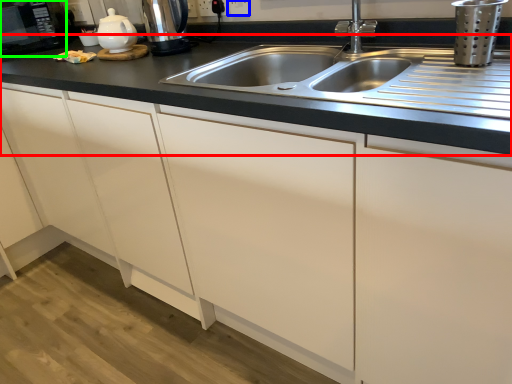
Question: Considering the real-world distances, which object is closest to countertop (highlighted by a red box)? electric outlet (highlighted by a blue box) or appliance (highlighted by a green box).

Choices:
 (A) electric outlet
 (B) appliance

Answer: (A)